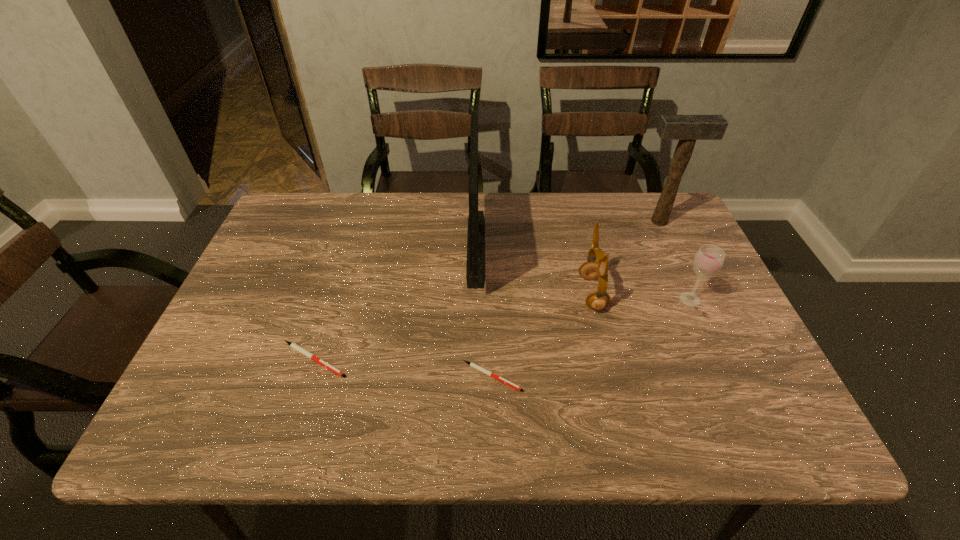
Where is `the left pen`? the left pen is located at coordinates (293, 345).

Locate an element on the screen. Image resolution: width=960 pixels, height=540 pixels. the second shortest object is located at coordinates (293, 345).

Where is `the shorter pen`? The width and height of the screenshot is (960, 540). the shorter pen is located at coordinates (471, 364).

You are a GUI agent. You are given a task and a screenshot of the screen. Output one action in this format:
    pyautogui.click(x=<x>, y=<y>)
    Task: Click on the shortest object
    This screenshot has height=540, width=960.
    Given the screenshot: What is the action you would take?
    [471, 364]

I want to click on mallet, so click(x=687, y=129).

At what (x,y) coordinates should I click in order to perform the action: click on monitor. Please return your answer as a coordinate pair (x, y). Looking at the image, I should click on (475, 269).

The image size is (960, 540). What are the coordinates of `wineglass` in the screenshot? It's located at (709, 259).

In order to click on the third tallest object in this screenshot , I will do pos(590,270).

Find the location of a particular element. earphone is located at coordinates (590, 270).

What are the coordinates of `free point located on the clicker of the taller pen` in the screenshot? It's located at (504, 360).